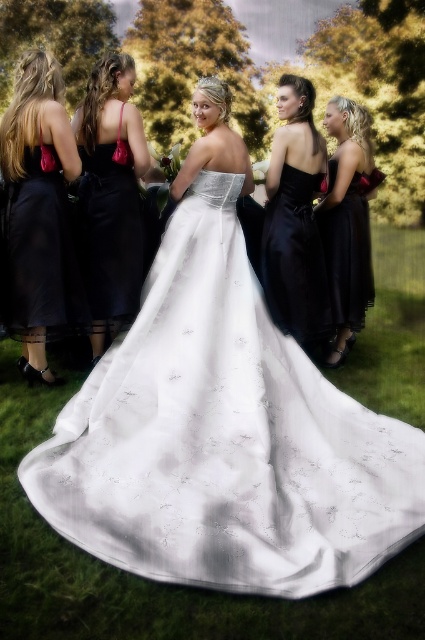
Based on the photo, you are a photographer at a wedding. You need to capture a photo of the satin white gown at center and the satin black dress at upper right. Based on their positions, which one is closer to the camera?

The satin white gown at center is closer to the camera because it is in front of the satin black dress at upper right.

You are standing in the wedding scene and want to place a small decoration at the closest point to you between point (x=25, y=244) and point (x=19, y=250). Which point should you choose?

Point (x=25, y=244) is closer to the viewer than point (x=19, y=250), so you should choose point (x=25, y=244) to place the decoration.

Based on the photo, you are a photographer setting up for the wedding photoshoot. You need to ensure that the satin white gown at center and the matte black dress at left are both visible in the frame. Based on their heights, which dress should you focus on adjusting the camera angle for to ensure both are fully visible?

The satin white gown at center is taller than the matte black dress at left. To ensure both are fully visible, adjust the camera angle to account for the height difference, focusing on the taller satin white gown at center to frame both appropriately.